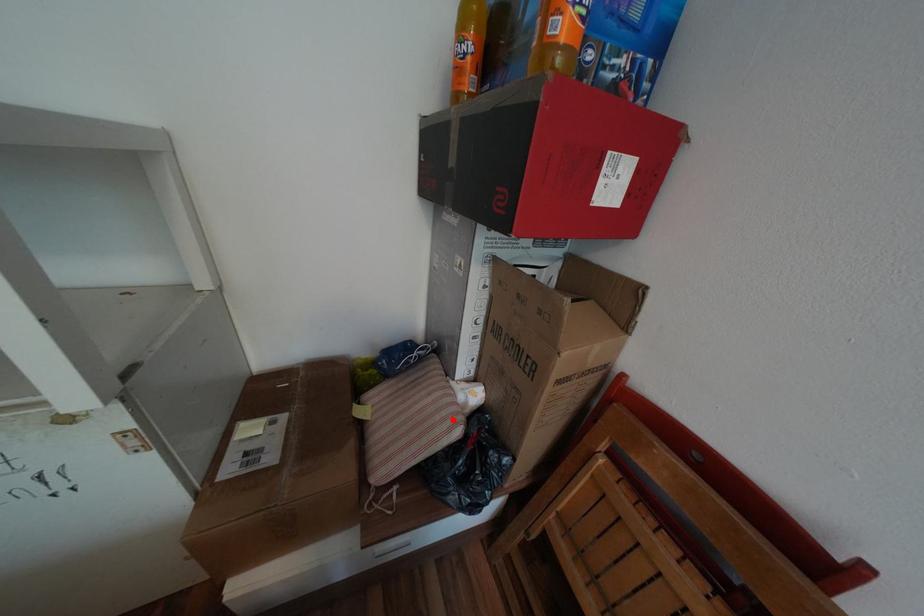
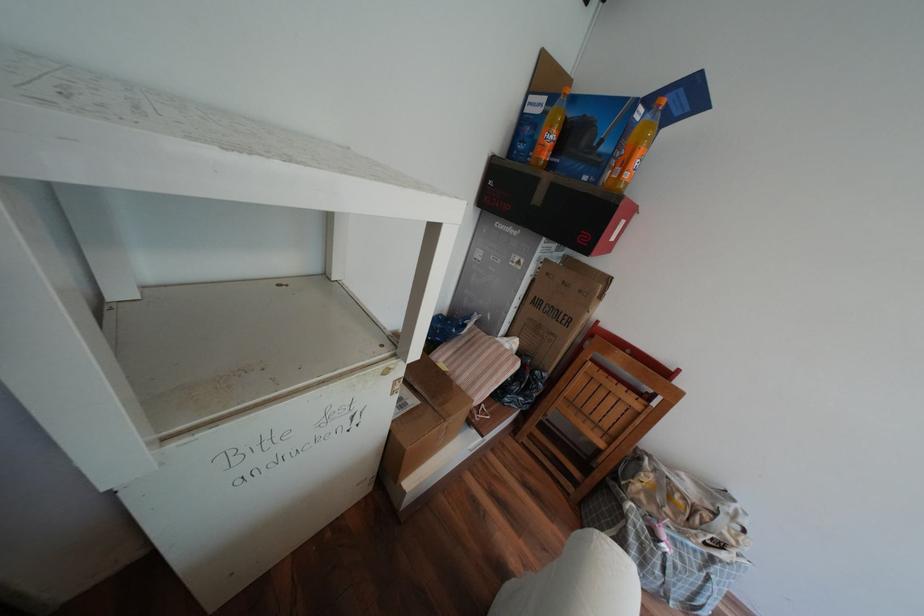
The point at the highlighted location is marked in the first image. Where is the corresponding point in the second image?

(517, 360)